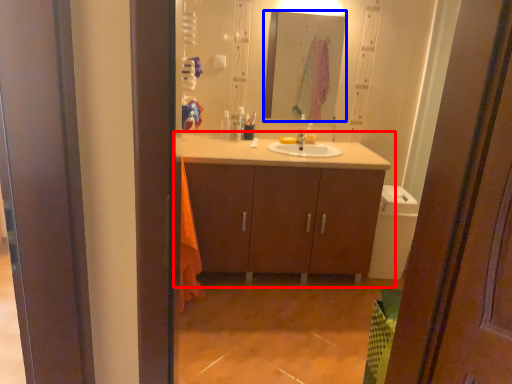
Question: Which object appears farthest to the camera in this image, bathroom cabinet (highlighted by a red box) or mirror (highlighted by a blue box)?

Choices:
 (A) bathroom cabinet
 (B) mirror

Answer: (B)